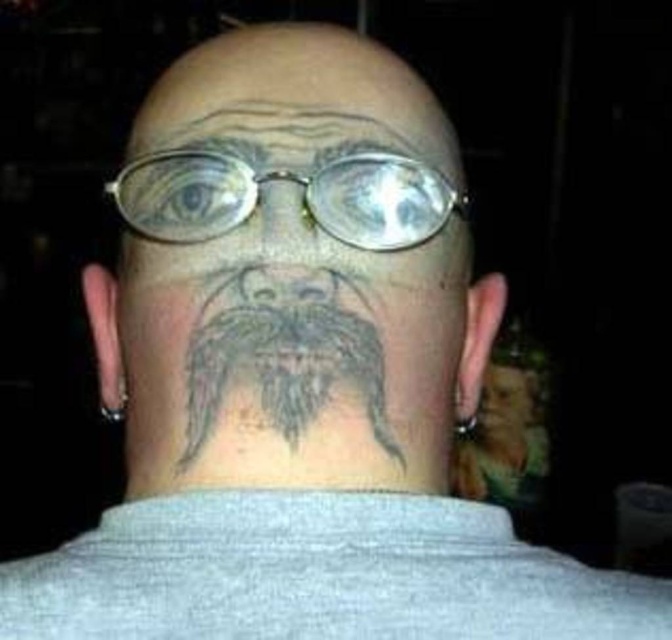
Question: Can you confirm if gray tattooed face at center is positioned above gray tattooed forehead at upper center?

Choices:
 (A) no
 (B) yes

Answer: (A)

Question: Is gray tattooed forehead at upper center closer to camera compared to gray/black hair at upper center?

Choices:
 (A) yes
 (B) no

Answer: (B)

Question: Which is farther from the gray tattooed beard at center?

Choices:
 (A) gray/black hair at upper center
 (B) gray tattooed face at center

Answer: (A)

Question: Among these points, which one is nearest to the camera?

Choices:
 (A) (228, 468)
 (B) (265, 291)
 (C) (194, 97)

Answer: (A)

Question: Is gray tattooed face at center thinner than gray tattooed beard at center?

Choices:
 (A) no
 (B) yes

Answer: (A)

Question: Which object is the closest to the gray tattooed beard at center?

Choices:
 (A) gray tattooed face at center
 (B) gray tattooed forehead at upper center
 (C) gray/black hair at upper center

Answer: (A)